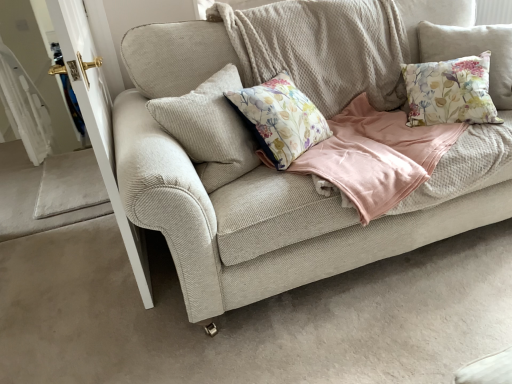
Question: Is floral fabric cushion at upper right, which is the second pillow from left to right, touching beige corduroy couch at center?

Choices:
 (A) no
 (B) yes

Answer: (A)

Question: Is floral fabric cushion at upper right, acting as the first pillow starting from the right, thinner than beige corduroy couch at center?

Choices:
 (A) yes
 (B) no

Answer: (A)

Question: From a real-world perspective, is floral fabric cushion at upper right, which is the second pillow from left to right, physically below beige corduroy couch at center?

Choices:
 (A) yes
 (B) no

Answer: (B)

Question: From a real-world perspective, is floral fabric cushion at upper right, acting as the first pillow starting from the right, on beige corduroy couch at center?

Choices:
 (A) no
 (B) yes

Answer: (B)

Question: Is floral fabric cushion at upper right, acting as the first pillow starting from the right, not close to beige corduroy couch at center?

Choices:
 (A) yes
 (B) no

Answer: (B)

Question: Is floral fabric cushion at upper right, acting as the first pillow starting from the right, outside of beige corduroy couch at center?

Choices:
 (A) yes
 (B) no

Answer: (B)

Question: Is white glossy door handle at left inside floral fabric cushion at upper right, which is the second pillow from left to right?

Choices:
 (A) no
 (B) yes

Answer: (A)

Question: Considering the relative positions of floral fabric cushion at upper right, acting as the first pillow starting from the right, and white glossy door handle at left in the image provided, is floral fabric cushion at upper right, acting as the first pillow starting from the right, to the right of white glossy door handle at left from the viewer's perspective?

Choices:
 (A) no
 (B) yes

Answer: (B)

Question: Considering the relative sizes of floral fabric cushion at upper right, which is the second pillow from left to right, and white glossy door handle at left in the image provided, is floral fabric cushion at upper right, which is the second pillow from left to right, wider than white glossy door handle at left?

Choices:
 (A) yes
 (B) no

Answer: (A)

Question: Can you confirm if floral fabric cushion at upper right, acting as the first pillow starting from the right, is bigger than white glossy door handle at left?

Choices:
 (A) yes
 (B) no

Answer: (A)

Question: From a real-world perspective, is floral fabric cushion at upper right, acting as the first pillow starting from the right, positioned under white glossy door handle at left based on gravity?

Choices:
 (A) yes
 (B) no

Answer: (B)

Question: Is floral fabric cushion at upper right, which is the second pillow from left to right, positioned before white glossy door handle at left?

Choices:
 (A) yes
 (B) no

Answer: (B)

Question: From the image's perspective, is beige corduroy couch at center under floral fabric cushion at upper right, acting as the first pillow starting from the right?

Choices:
 (A) yes
 (B) no

Answer: (A)